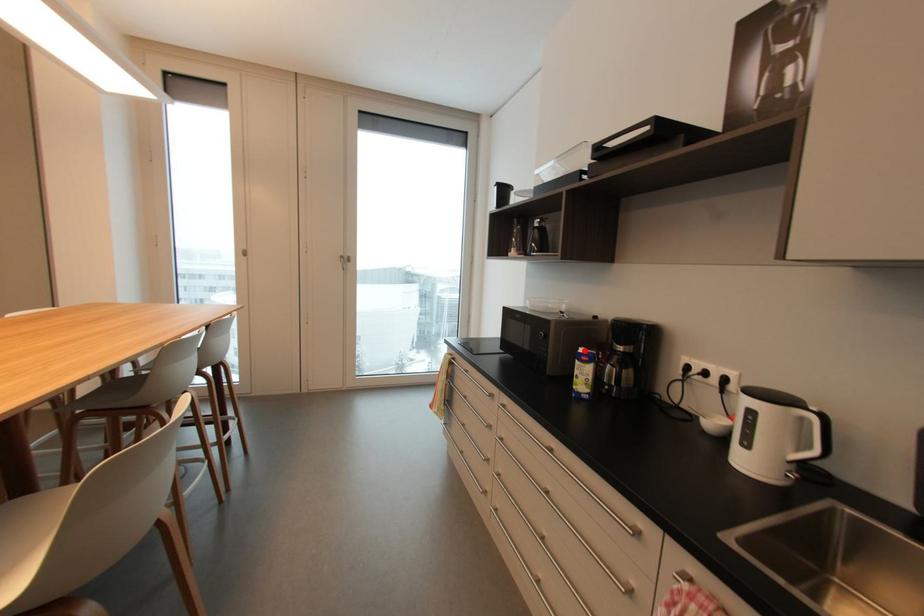
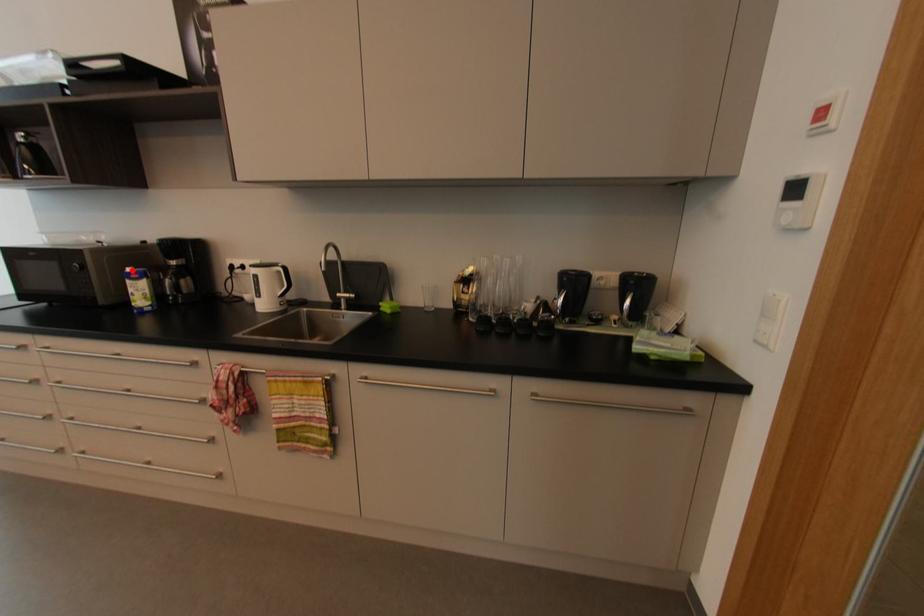
I am providing you with two images of the same scene from different viewpoints. A red point is marked on the first image and another point is marked on the second image. Are the points marked in image1 and image2 representing the same 3D position?

Yes